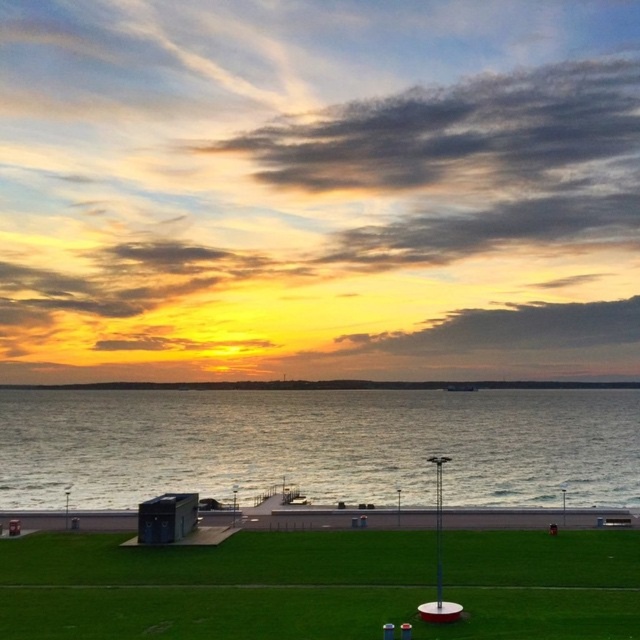
Question: Can you confirm if silvery reflective water at lower center is positioned to the right of green grass at lower center?

Choices:
 (A) yes
 (B) no

Answer: (B)

Question: Which point appears closest to the camera in this image?

Choices:
 (A) (138, 435)
 (B) (77, 596)

Answer: (B)

Question: Is silvery reflective water at lower center smaller than green grass at lower center?

Choices:
 (A) no
 (B) yes

Answer: (A)

Question: Which point is closer to the camera taking this photo?

Choices:
 (A) (273, 540)
 (B) (253, 467)

Answer: (A)

Question: Can you confirm if silvery reflective water at lower center is positioned to the left of green grass at lower center?

Choices:
 (A) no
 (B) yes

Answer: (B)